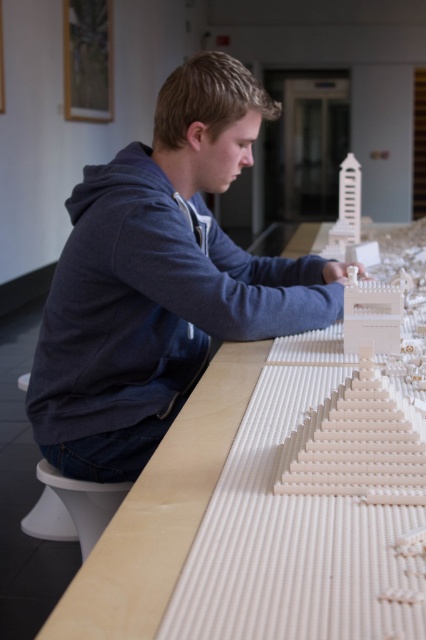
Is dark blue hoodie at center taller than light brown wood table at center?

Yes, dark blue hoodie at center is taller than light brown wood table at center.

Is point (184, 200) positioned before point (152, 570)?

No.

I want to click on dark blue hoodie at center, so click(x=161, y=280).